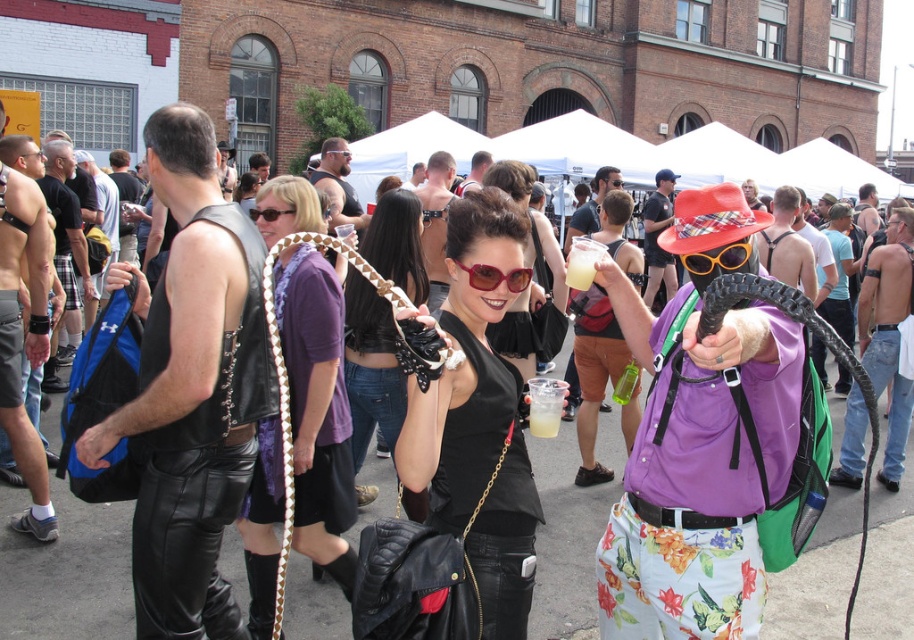
Does purple satin scarf at center have a smaller size compared to leather belt at center?

No.

Is purple satin scarf at center positioned behind leather belt at center?

No, it is not.

Is point (298, 403) closer to viewer compared to point (420, 280)?

Yes.

Identify the location of purple satin scarf at center. The width and height of the screenshot is (914, 640). [x=316, y=410].

Which is behind, point (296, 275) or point (688, 272)?

The point (296, 275) is behind.

Is purple satin scarf at center positioned at the back of black plastic goggles at center?

Yes, it is behind black plastic goggles at center.

Who is more forward, [321,506] or [700,257]?

Positioned in front is point [700,257].

At what (x,y) coordinates should I click in order to perform the action: click on purple satin scarf at center. Please return your answer as a coordinate pair (x, y). This screenshot has width=914, height=640. Looking at the image, I should click on (316, 410).

Does black plastic goggles at center appear under matte red sunglasses at center?

Incorrect, black plastic goggles at center is not positioned below matte red sunglasses at center.

Is point (708, 256) positioned before point (479, 268)?

No.

Does point (689, 260) lie behind point (474, 272)?

Yes, point (689, 260) is farther from viewer.

In order to click on black plastic goggles at center in this screenshot , I will do `click(719, 259)`.